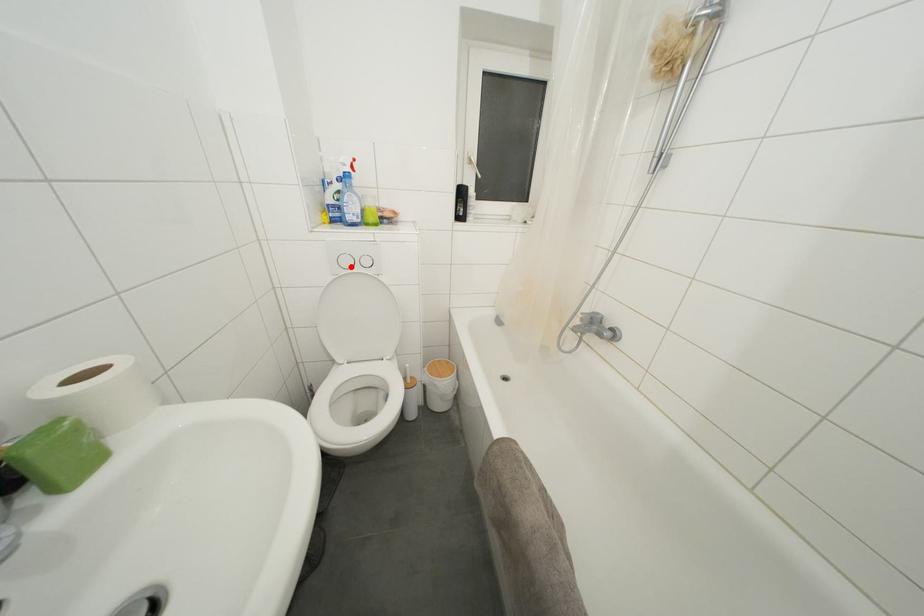
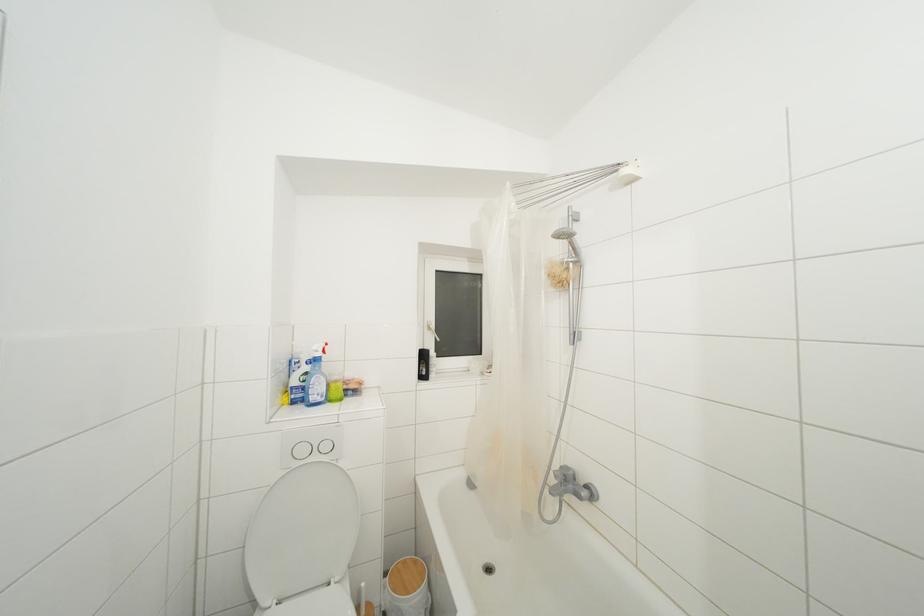
Where in the second image is the point corresponding to the highlighted location from the first image?

(307, 456)